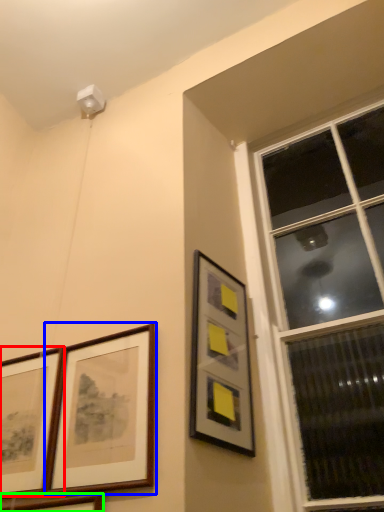
Question: Based on their relative distances, which object is nearer to picture frame (highlighted by a red box)? Choose from picture frame (highlighted by a blue box) and picture frame (highlighted by a green box).

Choices:
 (A) picture frame
 (B) picture frame

Answer: (A)